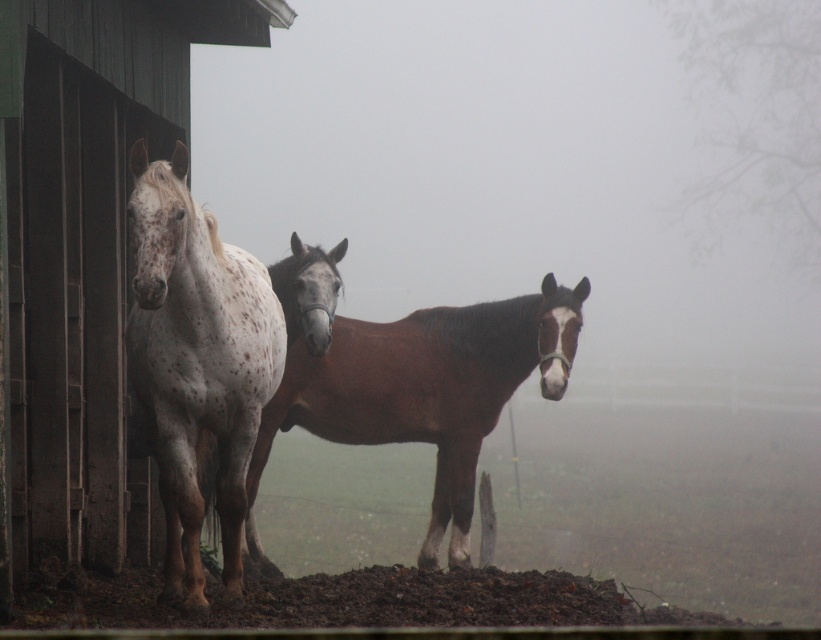
Question: Can you confirm if speckled white horse at left is positioned above brown glossy horse at center?

Choices:
 (A) yes
 (B) no

Answer: (A)

Question: Can you confirm if foggy atmosphere at center is positioned to the left of speckled white horse at left?

Choices:
 (A) no
 (B) yes

Answer: (A)

Question: Does speckled white horse at left have a smaller size compared to speckled white horse at center?

Choices:
 (A) yes
 (B) no

Answer: (B)

Question: Which point is farther to the camera?

Choices:
 (A) (226, 467)
 (B) (251, 483)

Answer: (B)

Question: Which point appears farthest from the camera in this image?

Choices:
 (A) (297, 326)
 (B) (484, 342)

Answer: (B)

Question: Estimate the real-world distances between objects in this image. Which object is farther from the speckled white horse at left?

Choices:
 (A) speckled white horse at center
 (B) foggy atmosphere at center
 (C) brown glossy horse at center

Answer: (B)